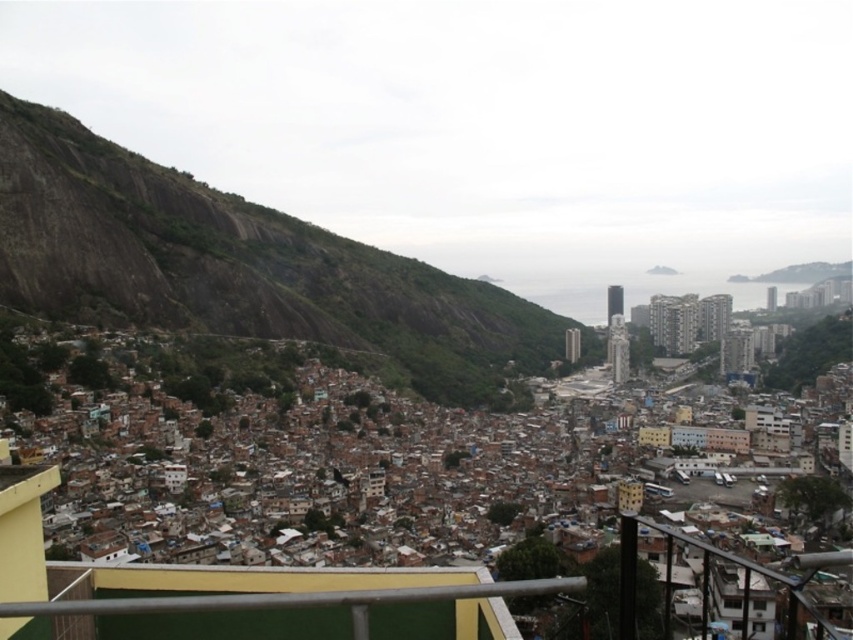
Between rustic stone mountain at left and metallic gray railing at lower center, which one appears on the right side from the viewer's perspective?

metallic gray railing at lower center

Does rustic stone mountain at left have a smaller size compared to metallic gray railing at lower center?

Actually, rustic stone mountain at left might be larger than metallic gray railing at lower center.

Which is in front, point (488, 401) or point (451, 586)?

Positioned in front is point (451, 586).

Image resolution: width=853 pixels, height=640 pixels. What are the coordinates of `rustic stone mountain at left` in the screenshot? It's located at (238, 266).